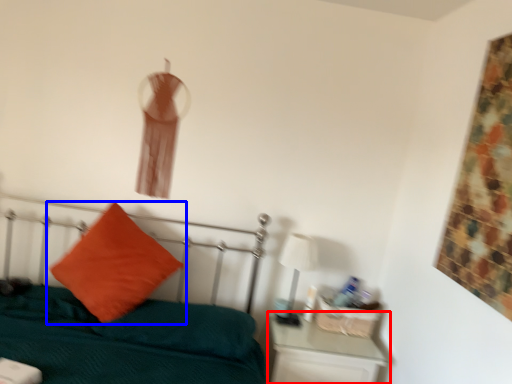
Question: Which object appears farthest to the camera in this image, nightstand (highlighted by a red box) or pillow (highlighted by a blue box)?

Choices:
 (A) nightstand
 (B) pillow

Answer: (A)